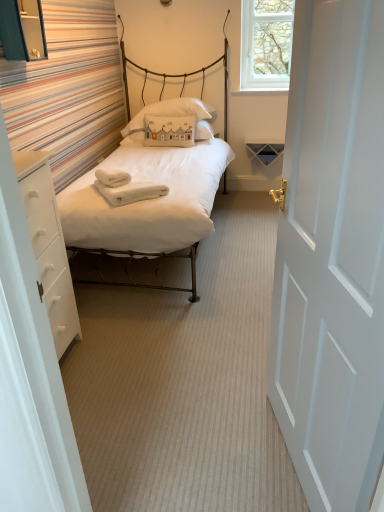
This screenshot has height=512, width=384. In order to click on free space behind white matte drawer at left in this screenshot , I will do `click(99, 314)`.